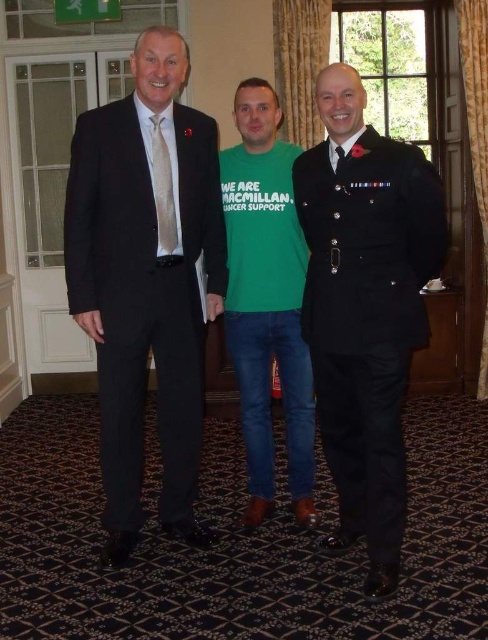
Measure the distance between uniformed man at center and camera.

A distance of 7.46 feet exists between uniformed man at center and camera.

Can you confirm if uniformed man at center is positioned to the right of green t-shirt at center?

Indeed, uniformed man at center is positioned on the right side of green t-shirt at center.

Image resolution: width=488 pixels, height=640 pixels. Describe the element at coordinates (366, 307) in the screenshot. I see `uniformed man at center` at that location.

The width and height of the screenshot is (488, 640). Identify the location of uniformed man at center. (366, 307).

The image size is (488, 640). Identify the location of black matte suit at left. click(x=146, y=280).

Is point (167, 161) positioned behind point (267, 470)?

No.

Identify the location of black matte suit at left. (146, 280).

Can you confirm if black matte suit at left is shorter than uniformed man at center?

Incorrect, black matte suit at left's height does not fall short of uniformed man at center's.

Between black matte suit at left and uniformed man at center, which one has less height?

With less height is uniformed man at center.

Is point (120, 109) farther from viewer compared to point (334, 483)?

That is False.

Where is `black matte suit at left`? This screenshot has width=488, height=640. black matte suit at left is located at coordinates (146, 280).